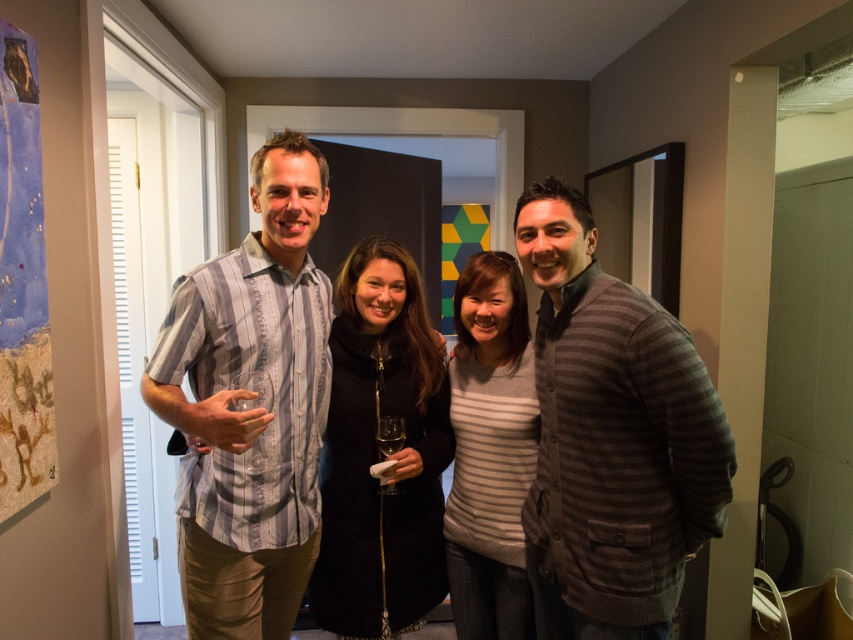
Question: Which of the following is the closest to the observer?

Choices:
 (A) (497, 609)
 (B) (345, 541)
 (C) (431, 531)

Answer: (B)

Question: Can you confirm if dark gray striped sweater at right is wider than black wool coat at center?

Choices:
 (A) no
 (B) yes

Answer: (B)

Question: Does striped cotton shirt at left appear on the right side of black wool coat at center?

Choices:
 (A) yes
 (B) no

Answer: (B)

Question: Which of the following is the farthest from the observer?

Choices:
 (A) black wool coat at center
 (B) striped cotton shirt at left
 (C) dark gray striped sweater at right

Answer: (A)

Question: Is dark gray striped sweater at right below black wool coat at center?

Choices:
 (A) no
 (B) yes

Answer: (A)

Question: Among these objects, which one is farthest from the camera?

Choices:
 (A) striped cotton shirt at left
 (B) dark gray striped sweater at right
 (C) striped knit sweater at center
 (D) black wool coat at center

Answer: (C)